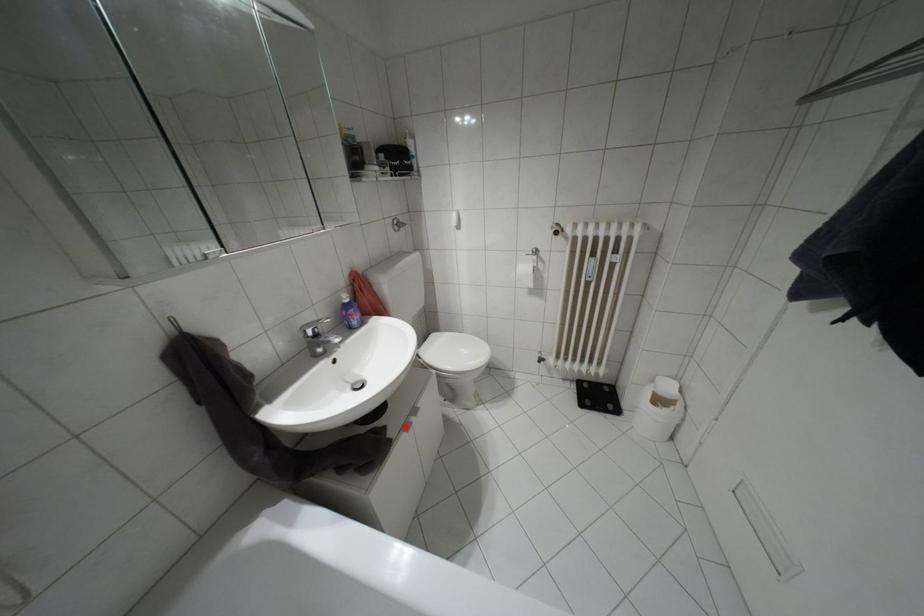
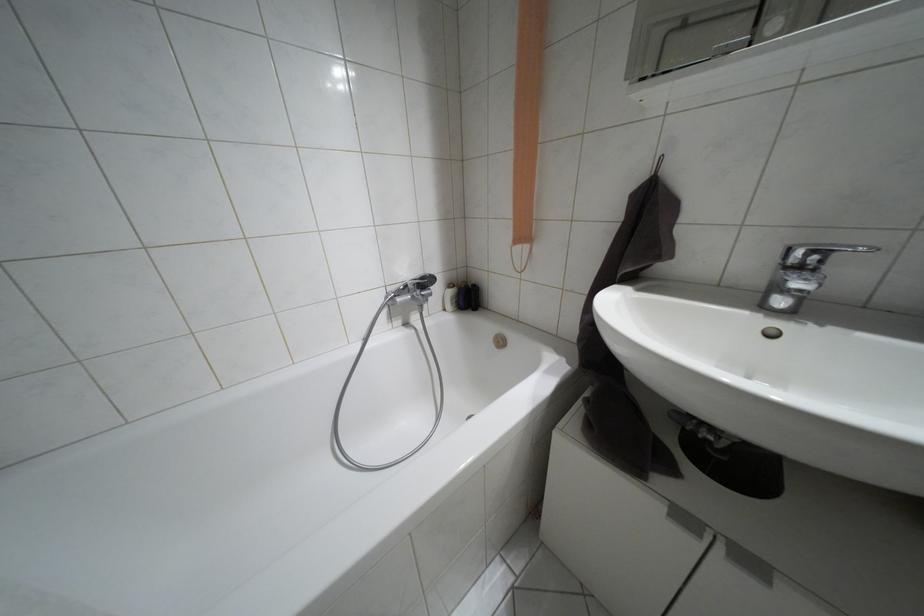
Locate, in the second image, the point that corresponds to the highlighted location in the first image.

(684, 517)